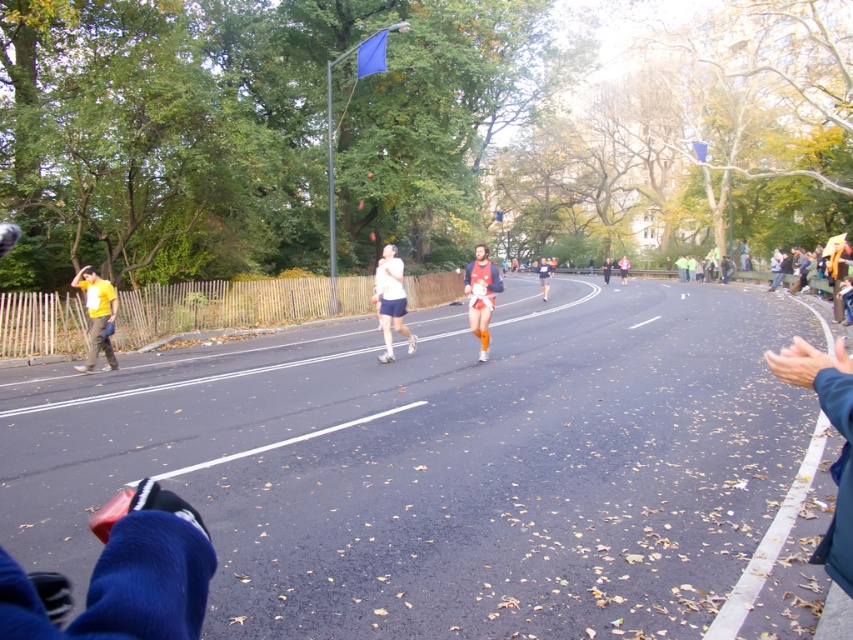
Question: Which of the following is the closest to the observer?

Choices:
 (A) (537, 262)
 (B) (402, 301)
 (C) (552, 593)

Answer: (C)

Question: Does white running shoes at center lie behind orange athletic wear at center?

Choices:
 (A) no
 (B) yes

Answer: (A)

Question: Can you confirm if yellow matte shirt at left is positioned to the right of white matte shorts at center?

Choices:
 (A) no
 (B) yes

Answer: (A)

Question: Estimate the real-world distances between objects in this image. Which object is closer to the yellow matte shirt at left?

Choices:
 (A) orange fabric runner at center
 (B) white running shoes at center
 (C) white matte shorts at center
 (D) orange athletic wear at center

Answer: (C)

Question: Among these points, which one is nearest to the camera?

Choices:
 (A) (614, 372)
 (B) (387, 330)

Answer: (A)

Question: Does white matte shorts at center have a smaller size compared to orange athletic wear at center?

Choices:
 (A) no
 (B) yes

Answer: (B)